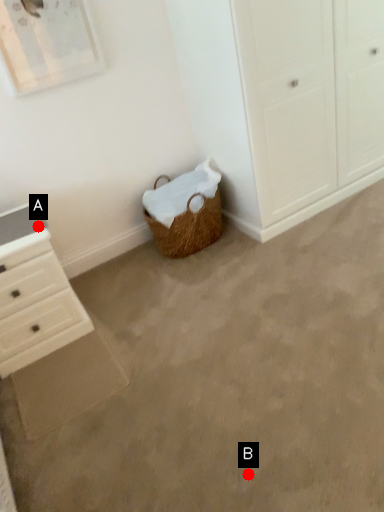
Question: Two points are circled on the image, labeled by A and B beside each circle. Which point is farther from the camera taking this photo?

Choices:
 (A) A is further
 (B) B is further

Answer: (A)